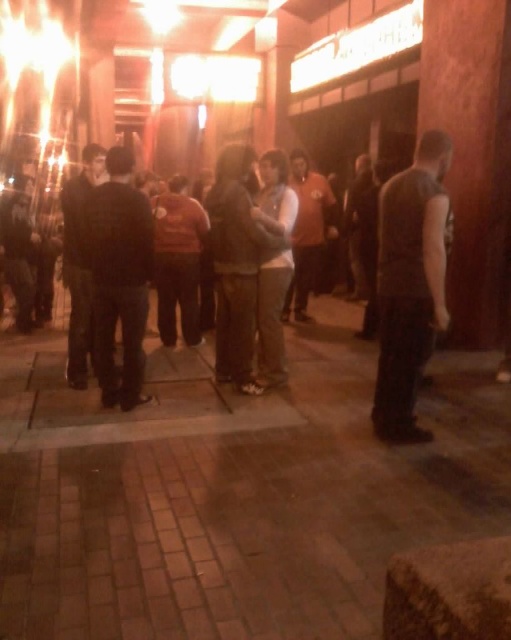
Question: Does dark gray vest at right have a lesser width compared to dark gray sweater at center?

Choices:
 (A) no
 (B) yes

Answer: (B)

Question: Which object appears farthest from the camera in this image?

Choices:
 (A) dark gray sweater at center
 (B) dark gray vest at right

Answer: (A)

Question: Which of the following is the farthest from the observer?

Choices:
 (A) dark gray vest at right
 (B) dark gray sweater at center

Answer: (B)

Question: Considering the relative positions of dark gray vest at right and dark gray sweater at center in the image provided, where is dark gray vest at right located with respect to dark gray sweater at center?

Choices:
 (A) below
 (B) above

Answer: (A)

Question: Does dark gray vest at right appear on the right side of dark gray sweater at center?

Choices:
 (A) no
 (B) yes

Answer: (B)

Question: Which point is farther to the camera?

Choices:
 (A) (135, 403)
 (B) (390, 346)

Answer: (A)